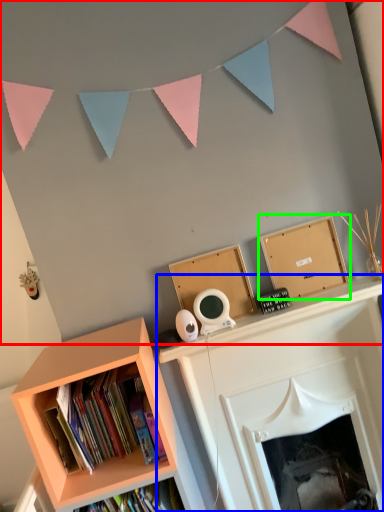
Question: Which object is the closest to the backdrop (highlighted by a red box)? Choose among these: fireplace (highlighted by a blue box) or shelf (highlighted by a green box).

Choices:
 (A) fireplace
 (B) shelf

Answer: (B)